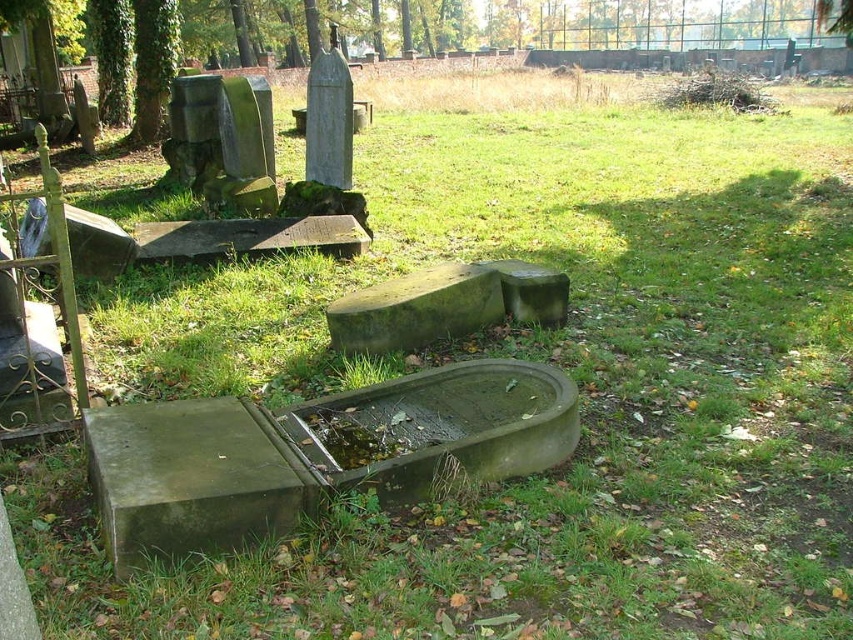
In the scene shown: You are standing at the entrance of the cemetery and want to find the green mossy stone at center. According to the coordinates given, where should you look relative to your position?

The green mossy stone at center is located at coordinates approximately 0.484 on the x and 0.488 on the y axis, which is near the center of the image.

You are standing in the cemetery and want to take a photo of both point (207, 492) and point (508, 310). Which point should you focus on first to ensure both are in clear view?

You should focus on point (207, 492) first because it is closer to the camera than point (508, 310), ensuring both are in focus when using depth of field.